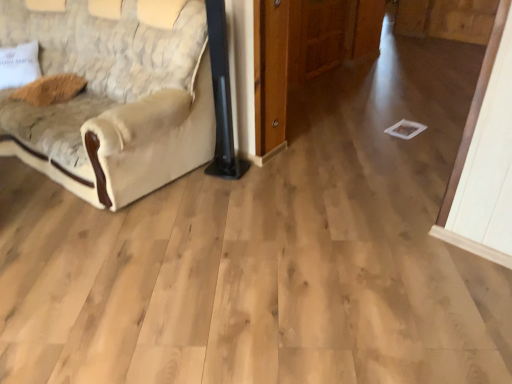
Question: In terms of width, does beige fabric couch at left look wider or thinner when compared to beige textured pillow at left, placed as the first pillow when sorted from left to right?

Choices:
 (A) wide
 (B) thin

Answer: (A)

Question: Considering the positions of point (120, 183) and point (33, 43), is point (120, 183) closer or farther from the camera than point (33, 43)?

Choices:
 (A) closer
 (B) farther

Answer: (A)

Question: Which object is the closest to the brown fuzzy pillow at upper left, the first pillow viewed from the right?

Choices:
 (A) beige textured pillow at left, the second pillow in the right-to-left sequence
 (B) beige fabric couch at left

Answer: (A)

Question: Considering the real-world distances, which object is farthest from the beige textured pillow at left, placed as the first pillow when sorted from left to right?

Choices:
 (A) brown fuzzy pillow at upper left, acting as the 2th pillow starting from the left
 (B) beige fabric couch at left

Answer: (B)